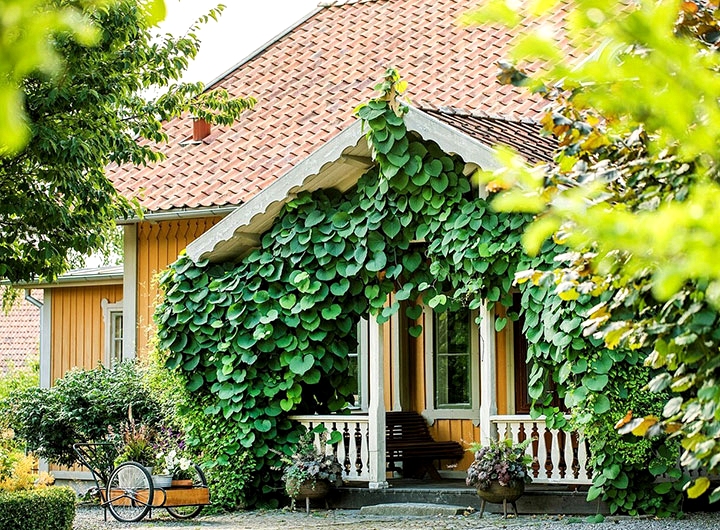
Identify the location of orange slats. This screenshot has height=530, width=720. pyautogui.click(x=165, y=244).